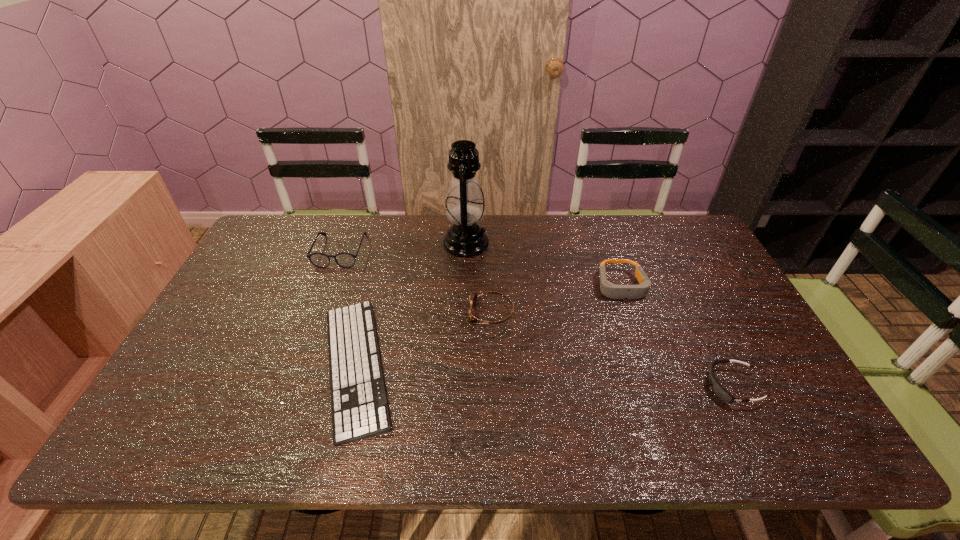
Locate an element on the screen. The height and width of the screenshot is (540, 960). vacant point located 0.230m on the front and back of the fifth object from left to right is located at coordinates (650, 370).

This screenshot has width=960, height=540. Find the location of `blank space located through the lenses of the leftmost goggles`. blank space located through the lenses of the leftmost goggles is located at coordinates click(x=385, y=313).

Identify the location of free location located through the lenses of the leftmost goggles. (344, 313).

Where is `blank space located through the lenses of the leftmost goggles`? The image size is (960, 540). blank space located through the lenses of the leftmost goggles is located at coordinates (340, 313).

The image size is (960, 540). I want to click on vacant region located 0.140m on the front and sides of the rightmost object, so click(x=650, y=386).

The image size is (960, 540). I want to click on vacant space situated 0.250m on the front and sides of the rightmost object, so click(606, 386).

Where is `blank space located 0.220m on the front and sides of the rightmost object`? blank space located 0.220m on the front and sides of the rightmost object is located at coordinates (617, 386).

Image resolution: width=960 pixels, height=540 pixels. What are the coordinates of `free space located on the right of the shortest object` in the screenshot? It's located at (496, 366).

Locate an element on the screen. This screenshot has height=540, width=960. oil lamp that is at the far edge is located at coordinates (464, 204).

This screenshot has height=540, width=960. I want to click on spectacles that is at the far edge, so click(x=345, y=260).